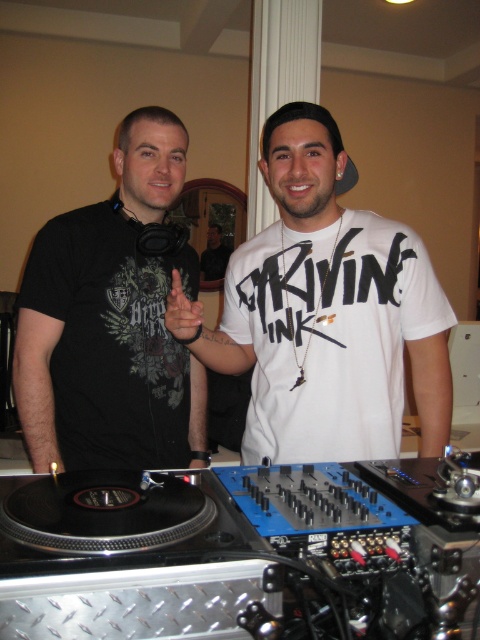
Does white matte t-shirt at center have a greater width compared to black matte t-shirt at left?

Yes, white matte t-shirt at center is wider than black matte t-shirt at left.

Where is `white matte t-shirt at center`? This screenshot has height=640, width=480. white matte t-shirt at center is located at coordinates coord(324,312).